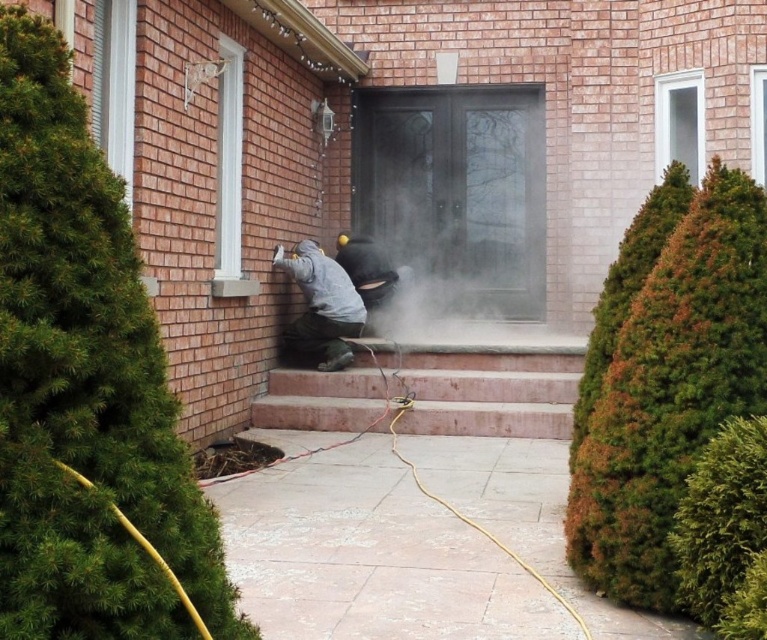
Question: Which object is the farthest from the gray matte jacket at center?

Choices:
 (A) smoke-filled glass door at center
 (B) pink concrete stairs at center

Answer: (A)

Question: Does pink concrete stairs at center come behind gray matte jacket at center?

Choices:
 (A) no
 (B) yes

Answer: (A)

Question: Is smoke-filled glass door at center above pink concrete stairs at center?

Choices:
 (A) yes
 (B) no

Answer: (A)

Question: Is smoke-filled glass door at center to the left of pink concrete stairs at center from the viewer's perspective?

Choices:
 (A) yes
 (B) no

Answer: (B)

Question: Among these objects, which one is farthest from the camera?

Choices:
 (A) gray matte jacket at center
 (B) smoke-filled glass door at center

Answer: (B)

Question: Which object is positioned farthest from the smoke-filled glass door at center?

Choices:
 (A) gray matte jacket at center
 (B) pink concrete stairs at center

Answer: (B)